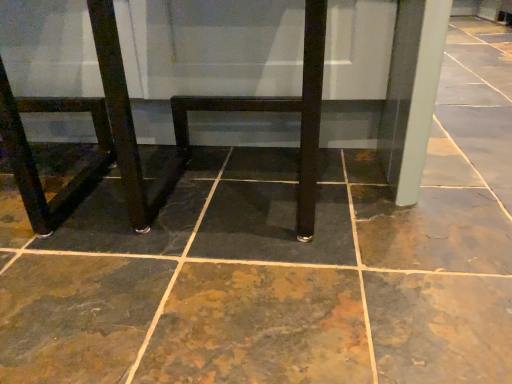
Question: Is matte black table at center turned away from matte black chair at lower left?

Choices:
 (A) no
 (B) yes

Answer: (A)

Question: Is matte black table at center thinner than matte black chair at lower left?

Choices:
 (A) no
 (B) yes

Answer: (A)

Question: Does matte black table at center have a greater height compared to matte black chair at lower left?

Choices:
 (A) no
 (B) yes

Answer: (B)

Question: Is matte black table at center aimed at matte black chair at lower left?

Choices:
 (A) no
 (B) yes

Answer: (A)

Question: Can you confirm if matte black table at center is positioned to the right of matte black chair at lower left?

Choices:
 (A) no
 (B) yes

Answer: (B)

Question: From the image's perspective, would you say matte black table at center is positioned over matte black chair at lower left?

Choices:
 (A) no
 (B) yes

Answer: (B)

Question: Considering the relative sizes of brown stone floor at center and matte black chair at lower left in the image provided, is brown stone floor at center smaller than matte black chair at lower left?

Choices:
 (A) no
 (B) yes

Answer: (A)

Question: Is brown stone floor at center next to matte black chair at lower left and touching it?

Choices:
 (A) yes
 (B) no

Answer: (B)

Question: Does brown stone floor at center have a larger size compared to matte black chair at lower left?

Choices:
 (A) no
 (B) yes

Answer: (B)

Question: Does brown stone floor at center have a lesser height compared to matte black chair at lower left?

Choices:
 (A) no
 (B) yes

Answer: (B)

Question: From the image's perspective, is brown stone floor at center under matte black chair at lower left?

Choices:
 (A) no
 (B) yes

Answer: (B)

Question: Does brown stone floor at center turn towards matte black chair at lower left?

Choices:
 (A) yes
 (B) no

Answer: (B)

Question: Is matte black table at center located within matte black chair at lower left?

Choices:
 (A) yes
 (B) no

Answer: (B)